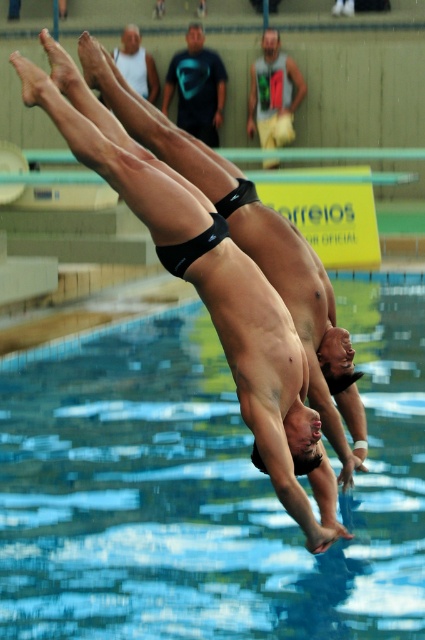
You are a photographer trying to capture the divers in the air. You notice the transparent glass water at center and the black matte swim trunks at center. Which object is closer to the camera?

The transparent glass water at center is closer to the camera because the black matte swim trunks at center is behind it.

You are a photographer taking a picture of the divers from the poolside. You notice two shirts, the green fabric shirt at upper center and the white matte tank top at upper center. Which shirt will appear larger in your photo?

The green fabric shirt at upper center is closer to the viewer than the white matte tank top at upper center, so it will appear larger in the photo.

You are a photographer trying to capture the divers midair. You notice the transparent glass water at center and the green fabric shirt at upper center in your viewfinder. Which object is positioned lower in the frame?

The transparent glass water at center is positioned below the green fabric shirt at upper center, so the transparent glass water at center is lower in the frame.